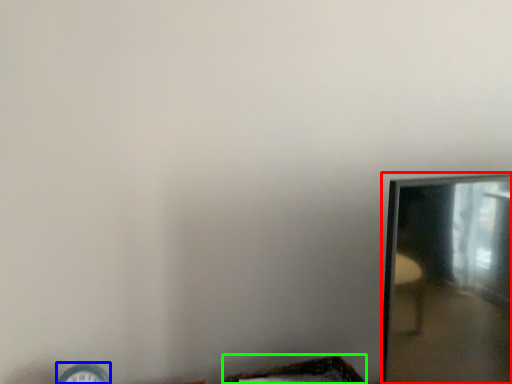
Question: Which object is positioned farthest from mirror (highlighted by a red box)? Select from clock (highlighted by a blue box) and basket (highlighted by a green box).

Choices:
 (A) clock
 (B) basket

Answer: (A)